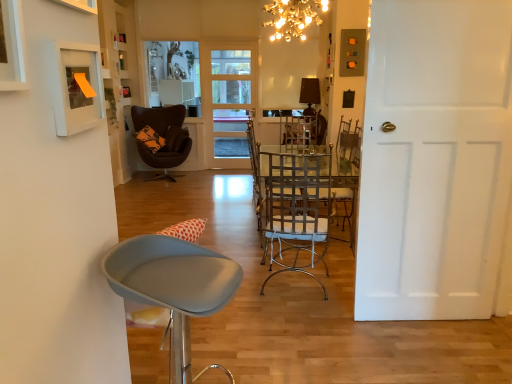
Question: From the image's perspective, is matte black lampshade at upper center, the first lamp viewed from the right, above dark brown leather chair at center, which is the third chair from right to left?

Choices:
 (A) no
 (B) yes

Answer: (B)

Question: Does matte black lampshade at upper center, the 1th lamp in the back-to-front sequence, come in front of dark brown leather chair at center, the third chair in the front-to-back sequence?

Choices:
 (A) yes
 (B) no

Answer: (B)

Question: Considering the relative positions of matte black lampshade at upper center, the 1th lamp in the back-to-front sequence, and dark brown leather chair at center, which is counted as the first chair, starting from the back, in the image provided, is matte black lampshade at upper center, the 1th lamp in the back-to-front sequence, behind dark brown leather chair at center, which is counted as the first chair, starting from the back,?

Choices:
 (A) yes
 (B) no

Answer: (A)

Question: Is matte black lampshade at upper center, the 2th lamp when ordered from front to back, bigger than dark brown leather chair at center, which is counted as the first chair, starting from the back?

Choices:
 (A) yes
 (B) no

Answer: (B)

Question: Is matte black lampshade at upper center, the first lamp viewed from the right, not near dark brown leather chair at center, the third chair in the front-to-back sequence?

Choices:
 (A) no
 (B) yes

Answer: (B)

Question: Considering the relative positions of matte black lampshade at upper center, the 1th lamp in the back-to-front sequence, and dark brown leather chair at center, the third chair in the front-to-back sequence, in the image provided, is matte black lampshade at upper center, the 1th lamp in the back-to-front sequence, to the left of dark brown leather chair at center, the third chair in the front-to-back sequence, from the viewer's perspective?

Choices:
 (A) yes
 (B) no

Answer: (B)

Question: Can white matte door at right, arranged as the 1th door when viewed from the front, be found inside dark brown leather chair at center, which is counted as the first chair, starting from the back?

Choices:
 (A) yes
 (B) no

Answer: (B)

Question: Is dark brown leather chair at center, which is the third chair from right to left, far away from white matte door at right, arranged as the 1th door when viewed from the front?

Choices:
 (A) no
 (B) yes

Answer: (B)

Question: Is dark brown leather chair at center, the third chair in the front-to-back sequence, closer to the viewer compared to white matte door at right, marked as the second door in a back-to-front arrangement?

Choices:
 (A) yes
 (B) no

Answer: (B)

Question: From a real-world perspective, is dark brown leather chair at center, the 1th chair from the left, on white matte door at right, acting as the first door starting from the right?

Choices:
 (A) yes
 (B) no

Answer: (B)

Question: Does dark brown leather chair at center, which is counted as the first chair, starting from the back, have a smaller size compared to white matte door at right, marked as the second door in a back-to-front arrangement?

Choices:
 (A) yes
 (B) no

Answer: (B)

Question: From the image's perspective, is dark brown leather chair at center, the third chair in the front-to-back sequence, on white matte door at right, marked as the second door in a back-to-front arrangement?

Choices:
 (A) yes
 (B) no

Answer: (A)

Question: From the image's perspective, is dark brown leather chair at center, which is the third chair from right to left, located above metallic silver chair at center, the first chair positioned from the right?

Choices:
 (A) yes
 (B) no

Answer: (A)